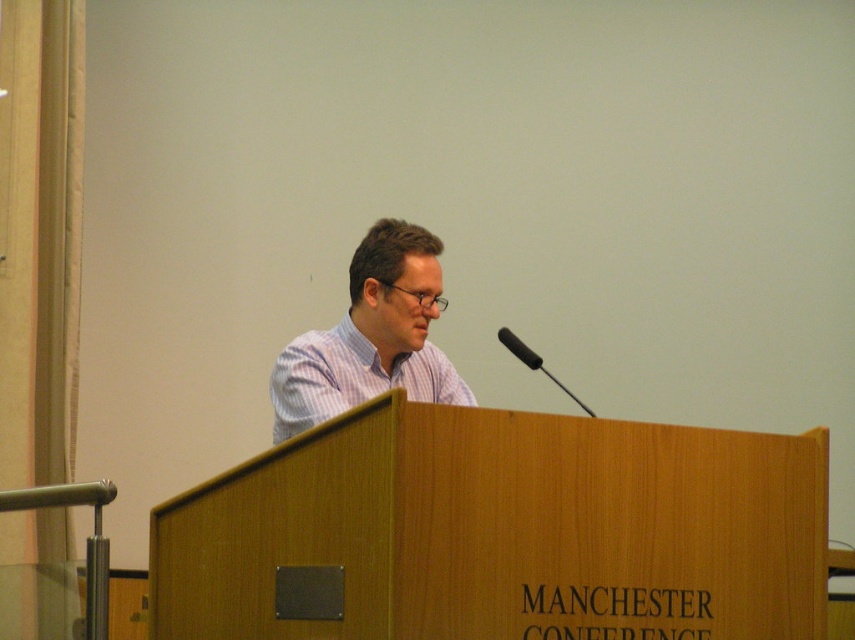
Question: Observing the image, what is the correct spatial positioning of white striped shirt at center in reference to black matte microphone at center?

Choices:
 (A) above
 (B) below

Answer: (A)

Question: Does white striped shirt at center appear on the right side of black matte microphone at center?

Choices:
 (A) no
 (B) yes

Answer: (A)

Question: Which object is farther from the camera taking this photo?

Choices:
 (A) black matte microphone at center
 (B) white striped shirt at center

Answer: (B)

Question: Which of the following is the closest to the observer?

Choices:
 (A) white striped shirt at center
 (B) black matte microphone at center

Answer: (B)

Question: In this image, where is white striped shirt at center located relative to black matte microphone at center?

Choices:
 (A) below
 (B) above

Answer: (B)

Question: Which point is farther to the camera?

Choices:
 (A) white striped shirt at center
 (B) black matte microphone at center

Answer: (A)